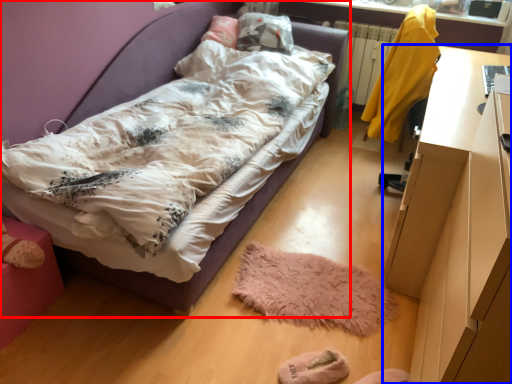
Question: Among these objects, which one is farthest to the camera, bed (highlighted by a red box) or desk (highlighted by a blue box)?

Choices:
 (A) bed
 (B) desk

Answer: (A)